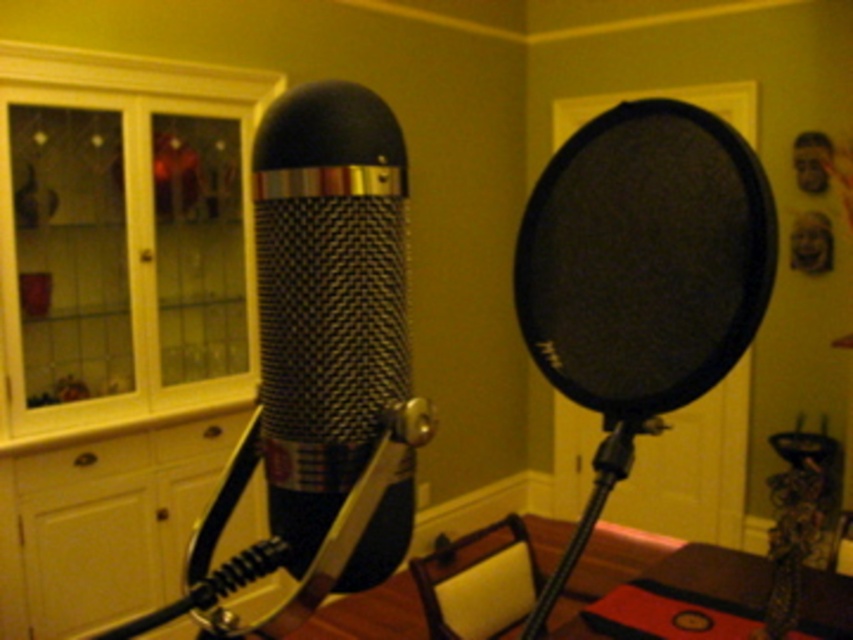
At what (x,y) coordinates should I click in order to perform the action: click on black mesh speaker at center. Please return your answer as a coordinate pair (x, y). The width and height of the screenshot is (853, 640). Looking at the image, I should click on (643, 257).

Measure the distance between black mesh speaker at center and camera.

23.91 inches

Where is `black mesh speaker at center`? black mesh speaker at center is located at coordinates (643, 257).